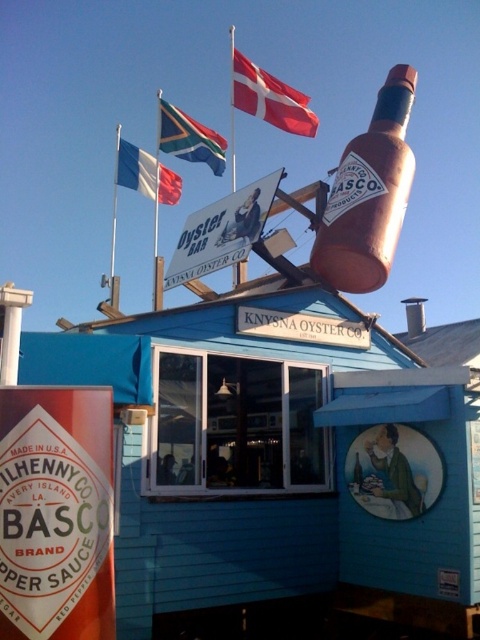
You are a customer standing in front of the Knymsna Oyster Co. building and want to know which flag is wider. Which one is wider between the red fabric flag at upper center and the white fabric flag at upper left?

The red fabric flag at upper center is wider than the white fabric flag at upper left.

You are standing in front of the Knymsna Oyster Co. building and want to determine the relative positions of two points marked on the building. Which of the two points, point (261, 93) or point (153, 168), is closer to you?

Point (261, 93) is closer to the viewer than point (153, 168).

You are a delivery person who needs to place a package between the blue wooden hut at center and the south african flag at upper center. The package requires a space of 6 meters. Can you fit it there?

The distance between the blue wooden hut at center and the south african flag at upper center is 7.39 meters, which is more than enough to accommodate the 6 meter requirement for the package.